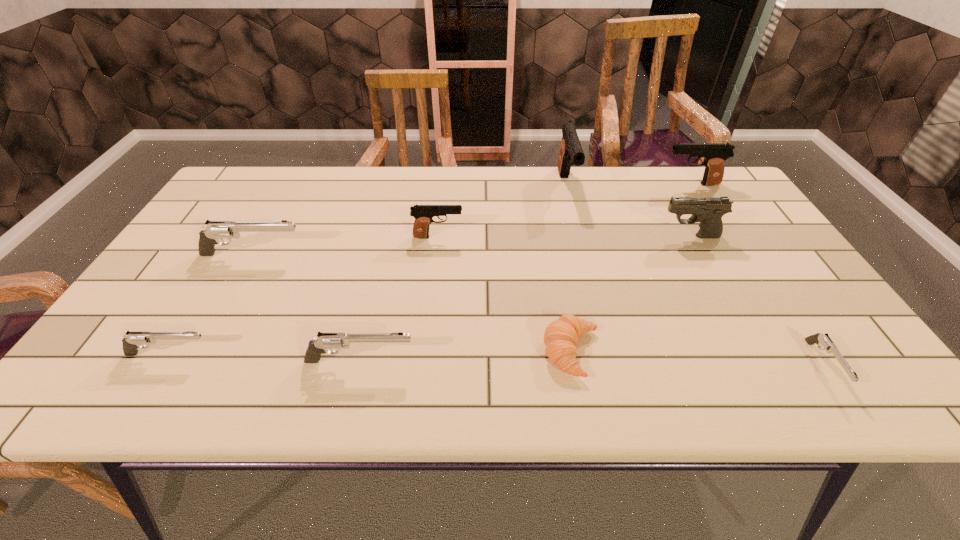
Find the location of a particular element. the biggest black pistol is located at coordinates (571, 153).

Find the location of a particular element. the third black pistol from right to left is located at coordinates tap(571, 153).

This screenshot has height=540, width=960. In order to click on the fifth nearest object in this screenshot , I will do `click(215, 230)`.

In order to click on the fourth nearest pistol in this screenshot , I will do `click(215, 230)`.

This screenshot has height=540, width=960. I want to click on the smallest black pistol, so click(423, 214).

You are a GUI agent. You are given a task and a screenshot of the screen. Output one action in this format:
    pyautogui.click(x=<x>, y=<y>)
    Task: Click on the fourth shortest object
    
    Given the screenshot: What is the action you would take?
    pyautogui.click(x=325, y=341)

What are the coordinates of `the second biggest silver pistol` in the screenshot? It's located at (325, 341).

Identify the location of the seventh tallest object. The width and height of the screenshot is (960, 540). click(132, 341).

Identify the location of the second smallest silver pistol. This screenshot has height=540, width=960. (132, 341).

You are a GUI agent. You are given a task and a screenshot of the screen. Output one action in this format:
    pyautogui.click(x=<x>, y=<y>)
    Task: Click on the crescent roll
    Image resolution: width=960 pixels, height=540 pixels.
    Given the screenshot: What is the action you would take?
    click(561, 336)